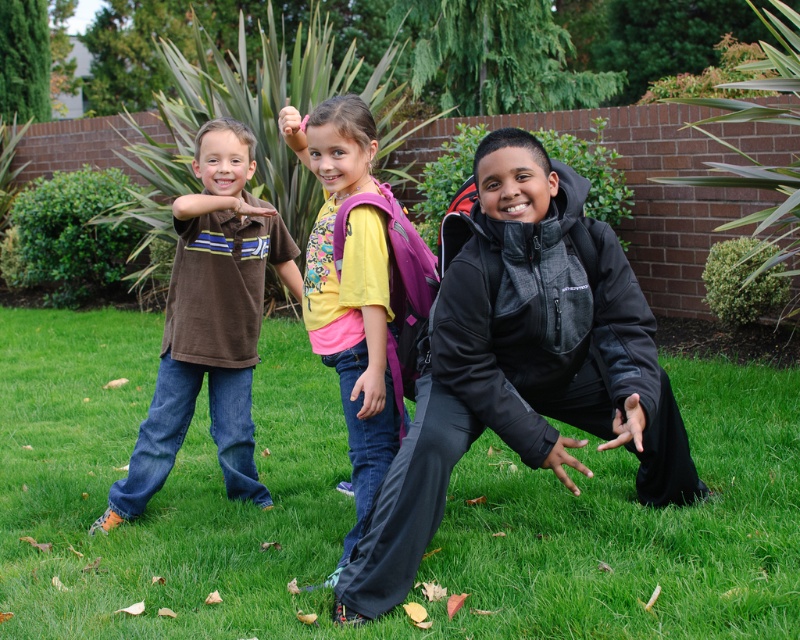
Question: Which point is farther from the camera taking this photo?

Choices:
 (A) (429, 604)
 (B) (296, 115)

Answer: (B)

Question: Does black softshell jacket at center have a lesser width compared to brown cotton shirt at left?

Choices:
 (A) yes
 (B) no

Answer: (B)

Question: Is black softshell jacket at center above brown cotton shirt at left?

Choices:
 (A) yes
 (B) no

Answer: (B)

Question: Does green grass at center have a greater width compared to brown cotton shirt at left?

Choices:
 (A) yes
 (B) no

Answer: (B)

Question: Which point is farther to the camera?

Choices:
 (A) (708, 432)
 (B) (197, 166)
 (C) (341, 221)

Answer: (A)

Question: Which object appears farthest from the camera in this image?

Choices:
 (A) green grass at center
 (B) yellow cotton shirt at center
 (C) brown cotton shirt at left

Answer: (C)